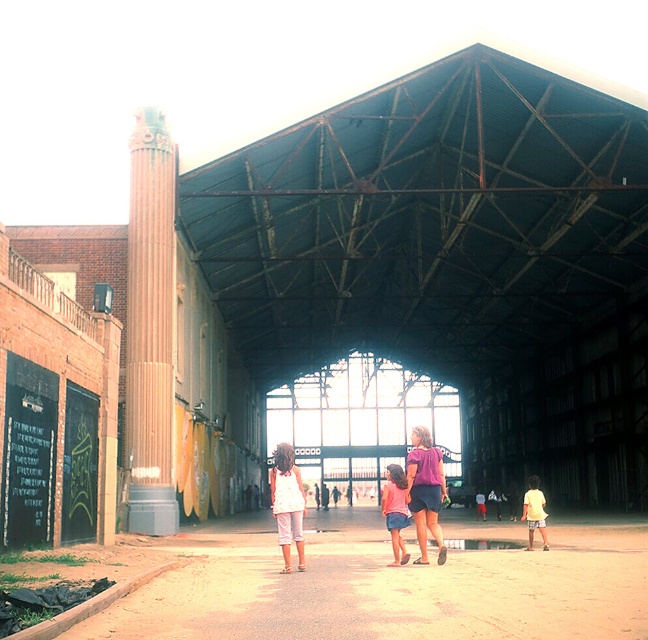
You are standing at the entrance of the industrial space and want to move towards the point at coordinates point (174, 150) and point (417, 518). Which point will you reach first?

You will reach point (174, 150) first because it is closer to you than point (417, 518), which is further away.

You are an interior designer planning to hang a new decorative item. You have a black chalkboard at left and a purple fabric shirt at center in the scene. Which object is higher up on the wall?

The black chalkboard at left is positioned over the purple fabric shirt at center, so it is higher up on the wall.